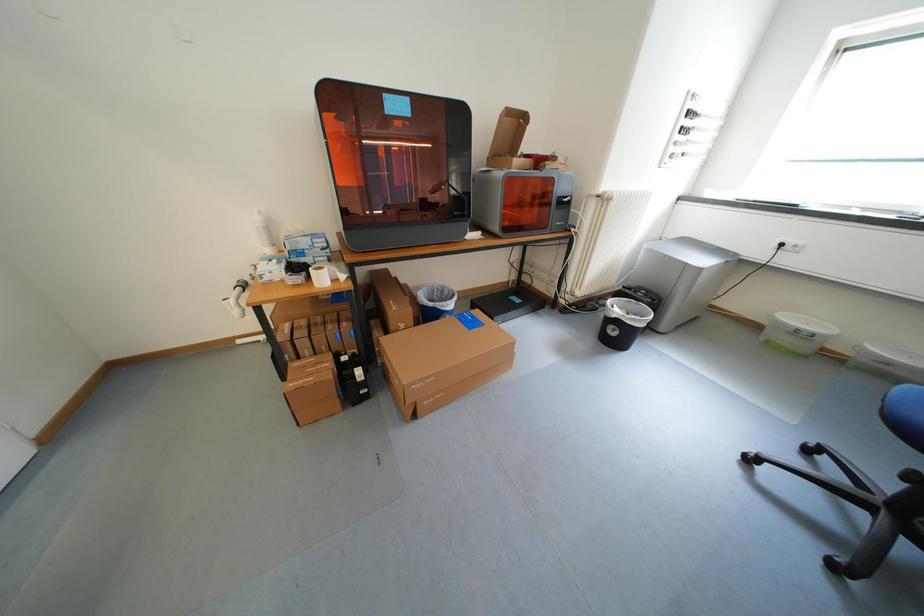
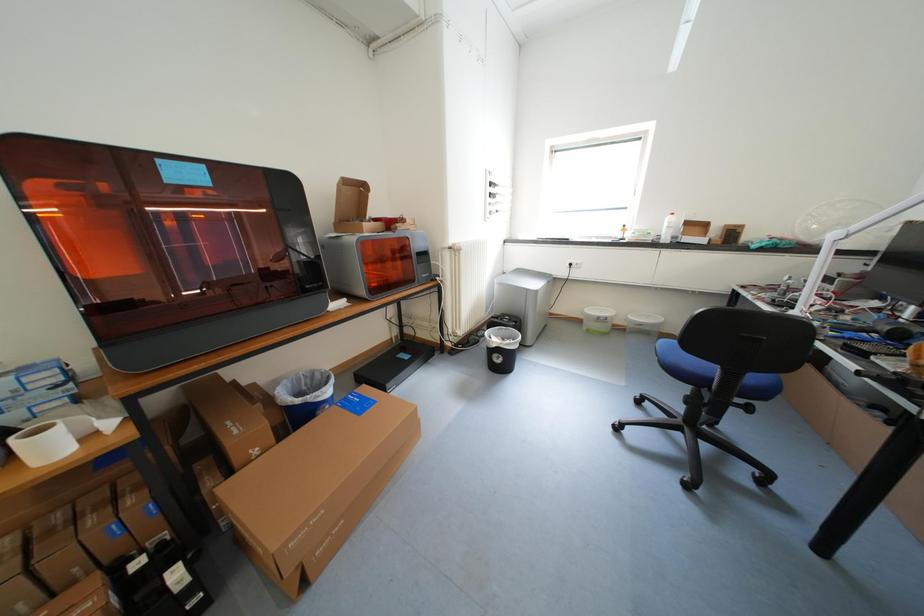
Question: The camera is either moving clockwise (left) or counter-clockwise (right) around the object. The first image is from the beginning of the video and the second image is from the end. Is the camera moving left or right when shooting the video?

Choices:
 (A) Left
 (B) Right

Answer: (A)